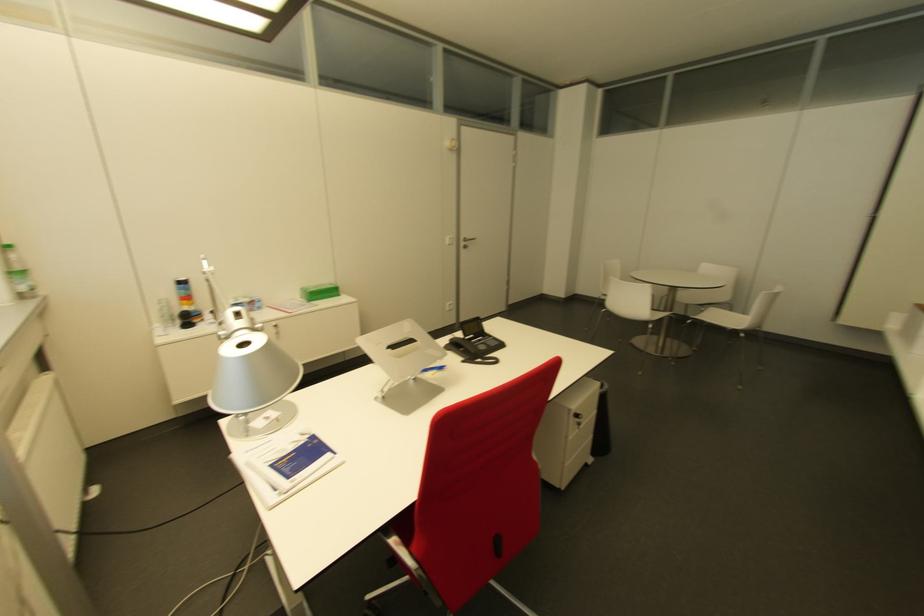
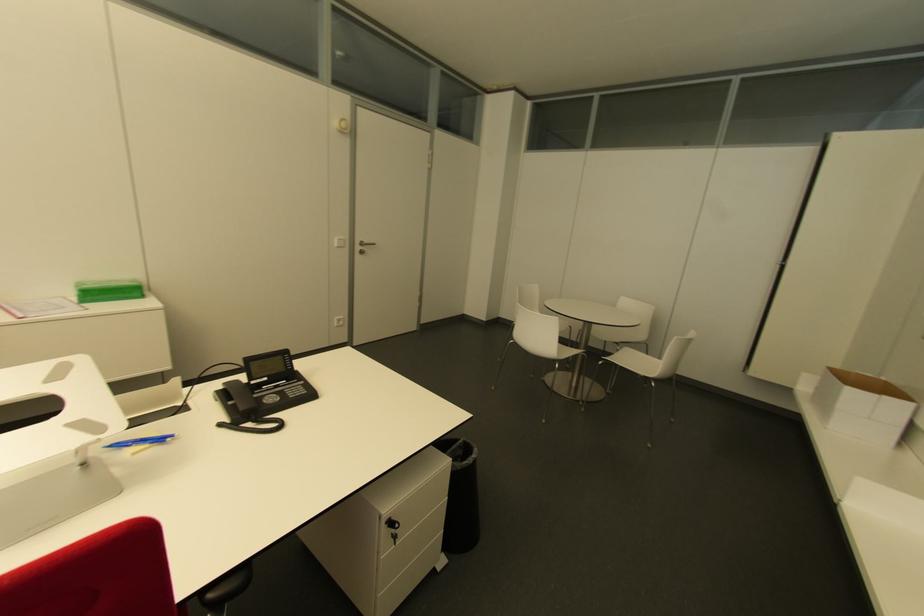
Locate, in the second image, the point that corresponds to point 447,339 in the first image.

(223, 384)